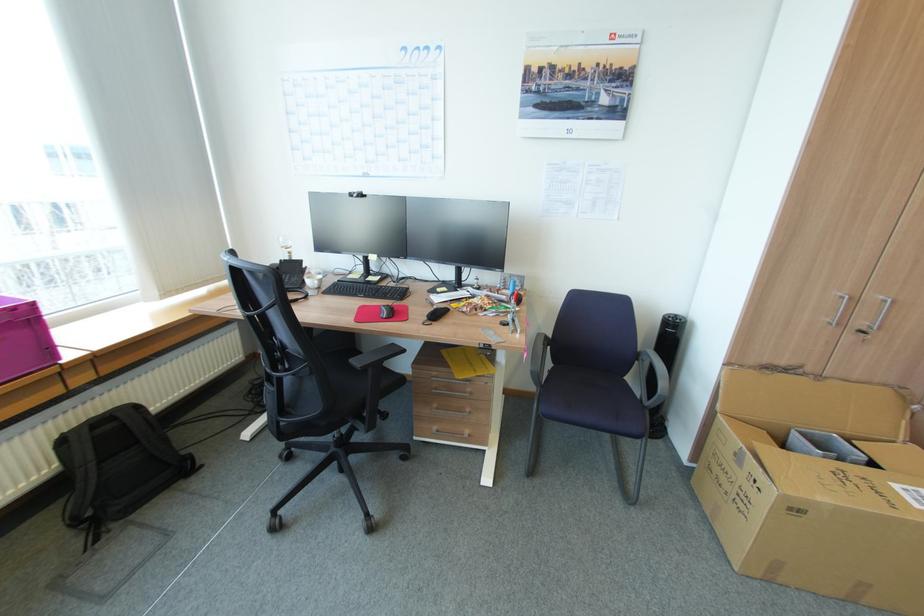
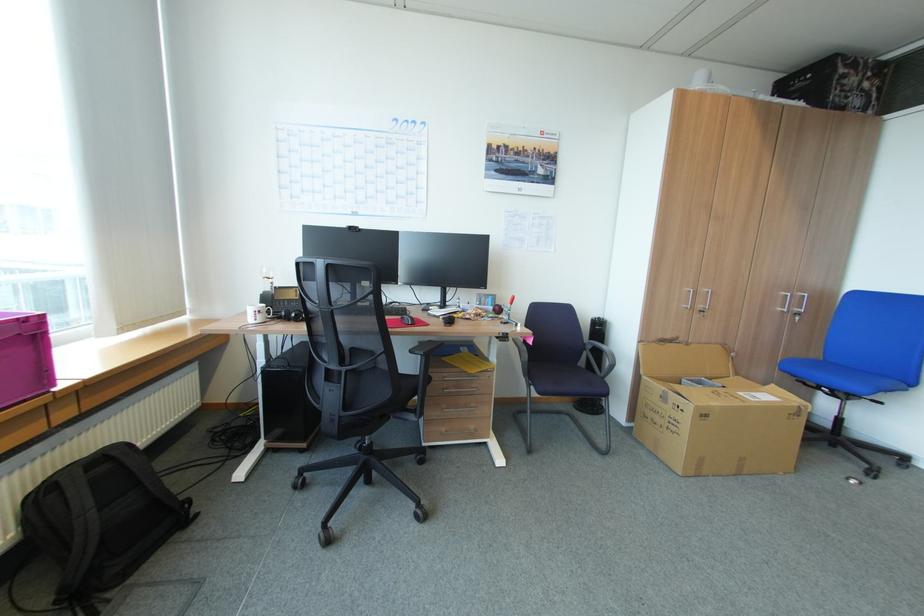
Locate, in the second image, the point that corresponds to point (643, 350) in the first image.

(590, 342)